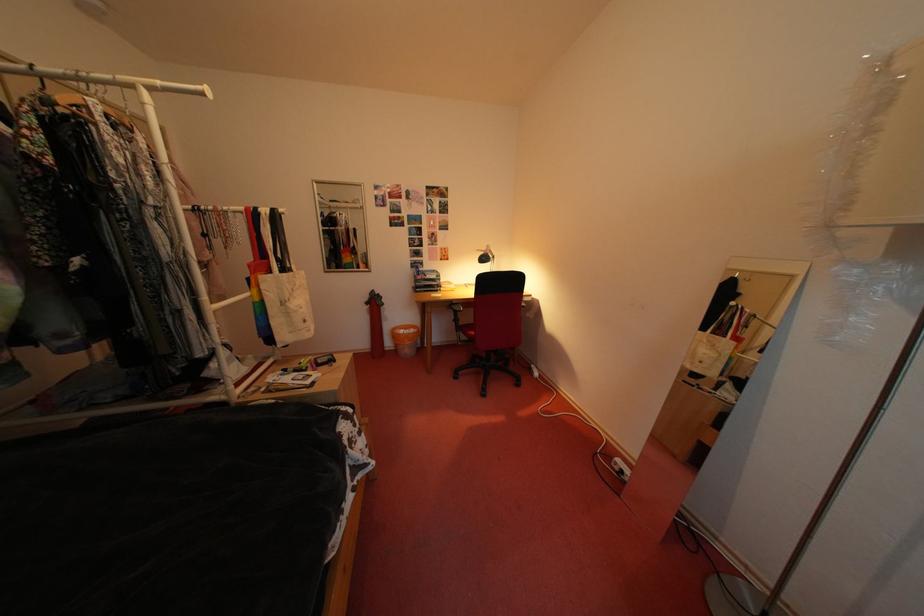
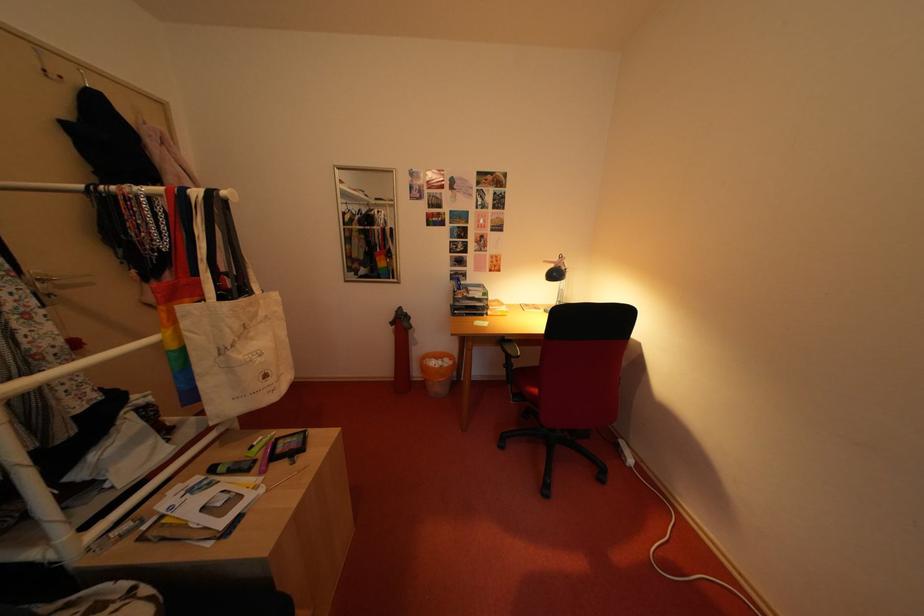
Locate, in the second image, the point that corresponds to [398,350] in the first image.

(427, 379)